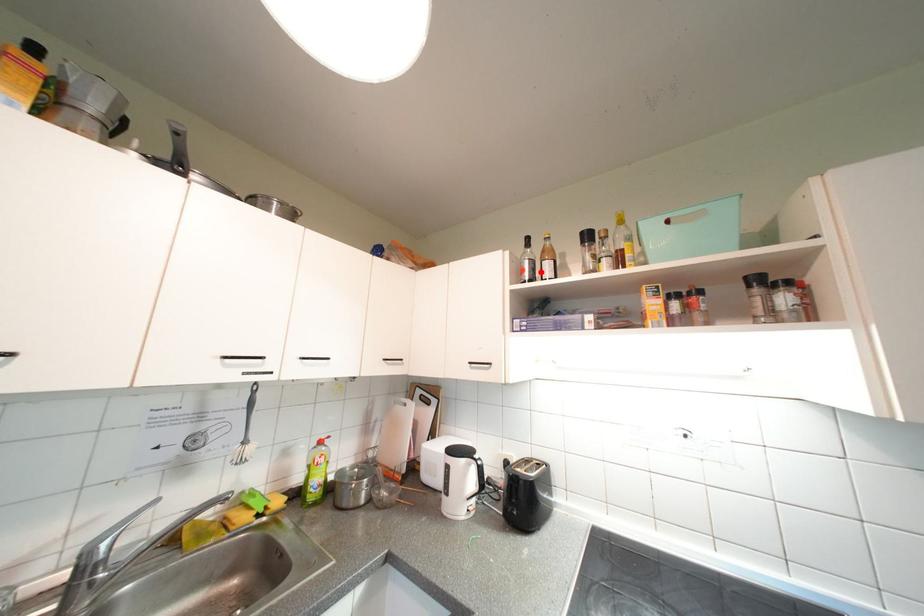
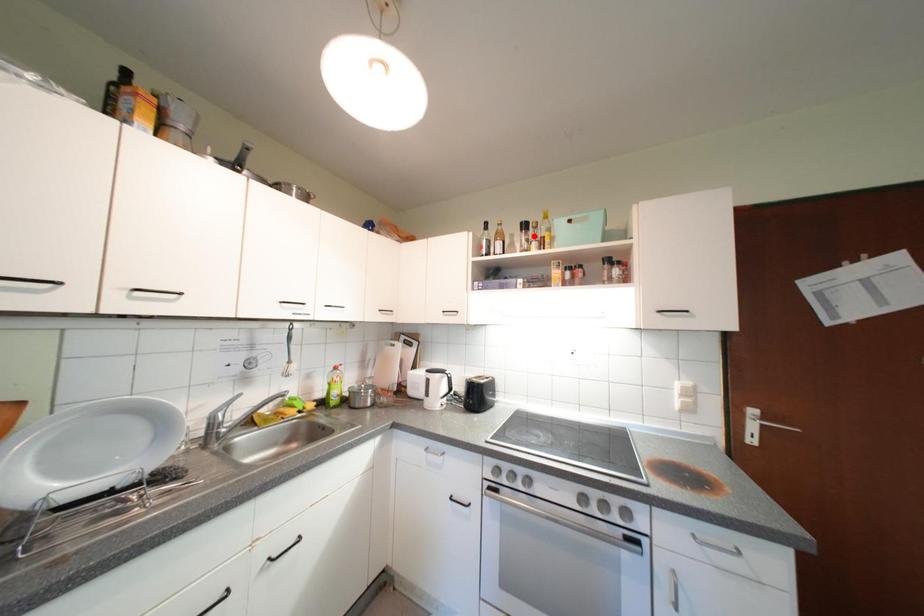
I am providing you with two images of the same scene from different viewpoints. A red point is marked on the first image and another point is marked on the second image. Does the point marked in image1 correspond to the same location as the one in image2?

No